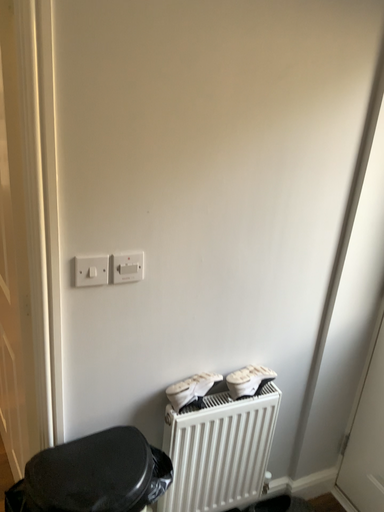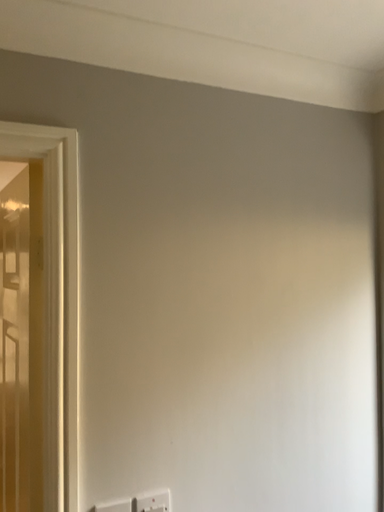
Question: Which way did the camera rotate in the video?

Choices:
 (A) rotated upward
 (B) rotated downward

Answer: (A)